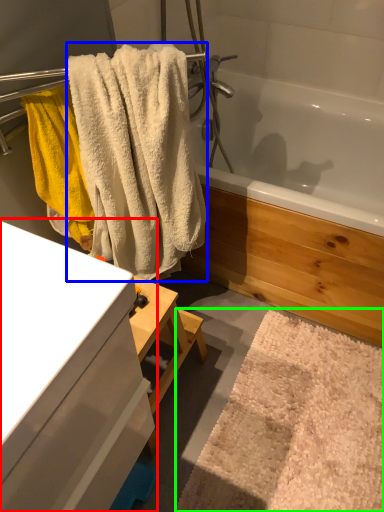
Question: Estimate the real-world distances between objects in this image. Which object is closer to bathroom cabinet (highlighted by a red box), towel (highlighted by a blue box) or bath mat (highlighted by a green box)?

Choices:
 (A) towel
 (B) bath mat

Answer: (A)